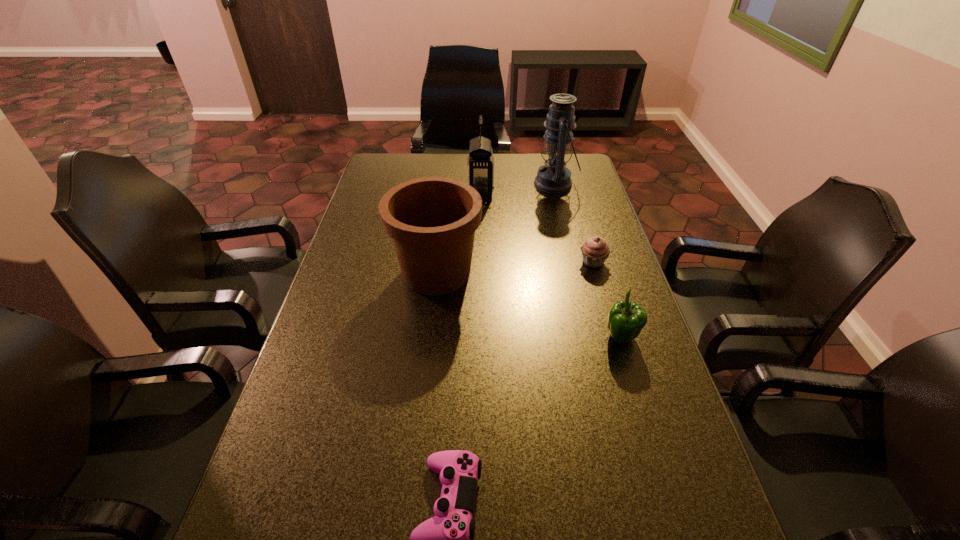
Locate an element on the screen. object that is at the far right corner is located at coordinates (554, 177).

At what (x,y) coordinates should I click in order to perform the action: click on free spot at the far edge of the desktop. Please return your answer as a coordinate pair (x, y). Looking at the image, I should click on (454, 171).

Locate an element on the screen. free region at the left edge of the desktop is located at coordinates (242, 535).

The image size is (960, 540). I want to click on vacant point at the right edge, so click(x=647, y=334).

Where is `free space at the far left corner of the desktop`? free space at the far left corner of the desktop is located at coordinates (372, 182).

Find the location of a particular element. empty space between the right lantern and the second shortest object is located at coordinates (574, 223).

This screenshot has width=960, height=540. Find the location of `vacant space in between the shorter lantern and the tallest object`. vacant space in between the shorter lantern and the tallest object is located at coordinates (518, 188).

Where is `empty space between the fourth tallest object and the shorter lantern`? The width and height of the screenshot is (960, 540). empty space between the fourth tallest object and the shorter lantern is located at coordinates (551, 266).

The image size is (960, 540). Find the location of `vacant space that is in between the second shortest object and the shorter lantern`. vacant space that is in between the second shortest object and the shorter lantern is located at coordinates (537, 228).

Where is `empty location between the second shortest object and the third shortest object`? This screenshot has height=540, width=960. empty location between the second shortest object and the third shortest object is located at coordinates (607, 300).